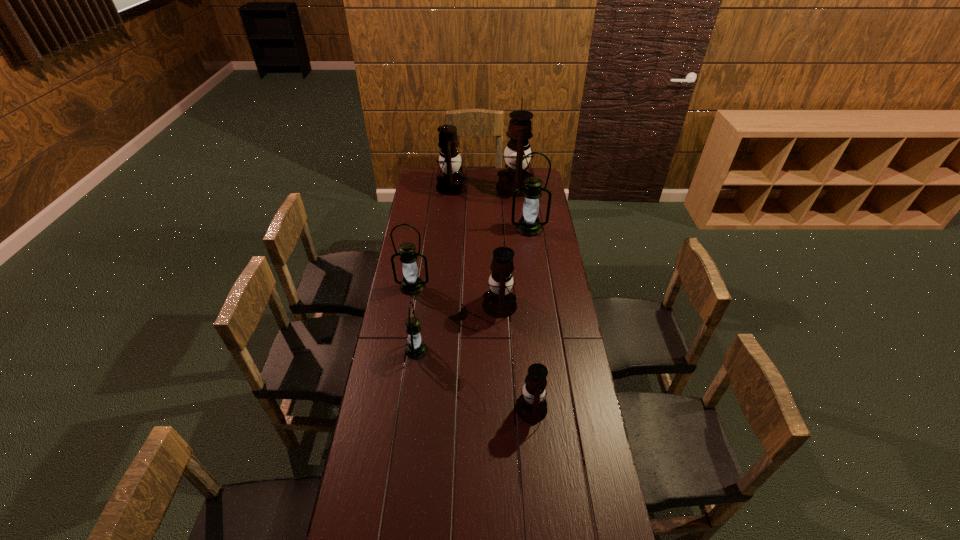
Locate an element on the screen. This screenshot has height=540, width=960. brown lantern that is the second closest one to the nearest green lantern is located at coordinates (531, 407).

Locate which brown lantern ranks third in proximity to the smallest brown lantern. Please provide its 2D coordinates. Your answer should be formatted as a tuple, i.e. [(x, y)], where the tuple contains the x and y coordinates of a point satisfying the conditions above.

[(452, 182)]

I want to click on green lantern that is the closest to the third smallest brown lantern, so click(x=529, y=225).

Locate an element on the screen. green lantern object that ranks as the closest to the sixth farthest lantern is located at coordinates (412, 284).

Locate an element on the screen. This screenshot has height=540, width=960. vacant space that satisfies the following two spatial constraints: 1. on the side where the farthest green lantern emits light; 2. on the side where the sixth farthest lantern emits light is located at coordinates (545, 350).

I want to click on vacant space that satisfies the following two spatial constraints: 1. on the side of the leftmost brown lantern, there is a wick adjustment knob; 2. on the side where the second nearest green lantern emits light, so click(x=444, y=286).